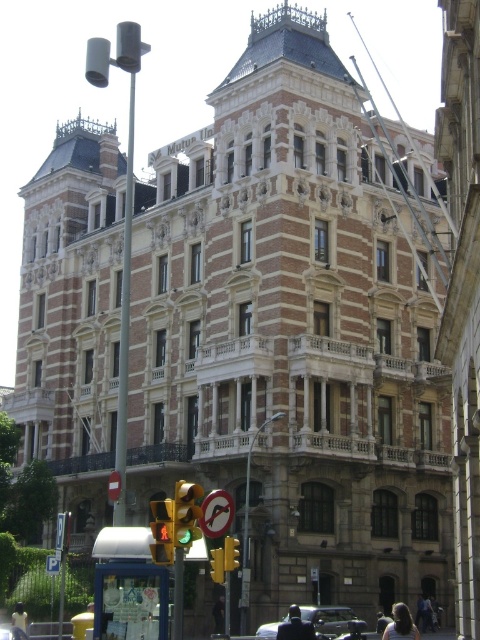
Which is in front, point (273, 624) or point (222, 572)?

Positioned in front is point (222, 572).

Can you confirm if shiny black car at lower center is smaller than yellow/glass traffic light at lower center?

Yes.

You are a GUI agent. You are given a task and a screenshot of the screen. Output one action in this format:
    pyautogui.click(x=<x>, y=<y>)
    Task: Click on the shiny black car at lower center
    Image resolution: width=480 pixels, height=640 pixels.
    Given the screenshot: What is the action you would take?
    pyautogui.click(x=327, y=618)

From the picture: Can you confirm if metallic pole at left is smaller than dark hair at center?

Result: Actually, metallic pole at left might be larger than dark hair at center.

Who is taller, metallic pole at left or dark hair at center?

With more height is metallic pole at left.

Identify the location of metallic pole at left. (124, 321).

Identify the location of metallic pole at left. (124, 321).

Which is more to the left, metallic pole at left or yellow/glass traffic light at lower center?

Positioned to the left is metallic pole at left.

Which is behind, point (117, 506) or point (218, 579)?

Positioned behind is point (117, 506).

At what (x,y) coordinates should I click in order to perform the action: click on metallic pole at left. Please return your answer as a coordinate pair (x, y). The width and height of the screenshot is (480, 640). Looking at the image, I should click on (124, 321).